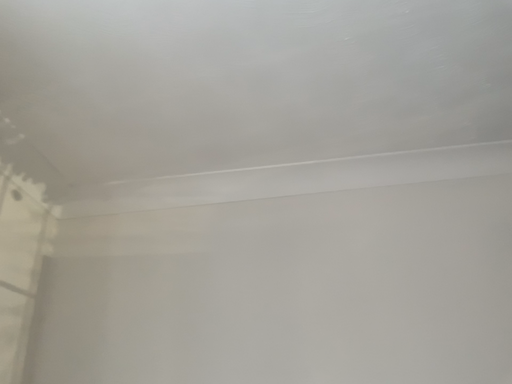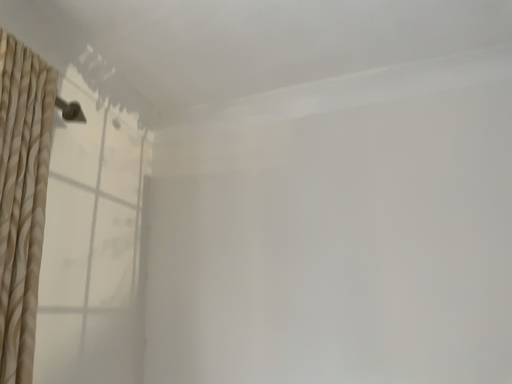
Question: Which way did the camera rotate in the video?

Choices:
 (A) rotated upward
 (B) rotated downward

Answer: (B)